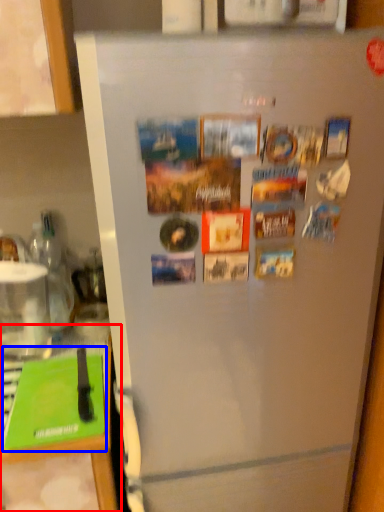
Question: Which point is further to the camera, counter top (highlighted by a red box) or magazine (highlighted by a blue box)?

Choices:
 (A) counter top
 (B) magazine

Answer: (B)